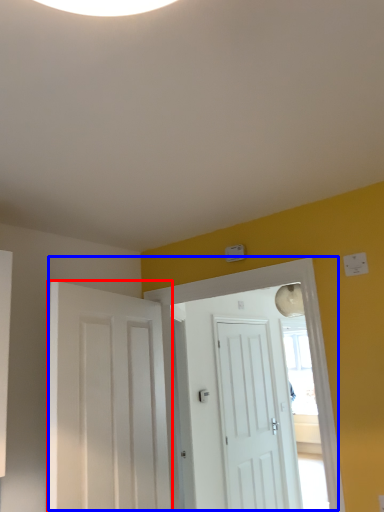
Question: Which of the following is the farthest to the observer, door (highlighted by a red box) or door (highlighted by a blue box)?

Choices:
 (A) door
 (B) door

Answer: (B)